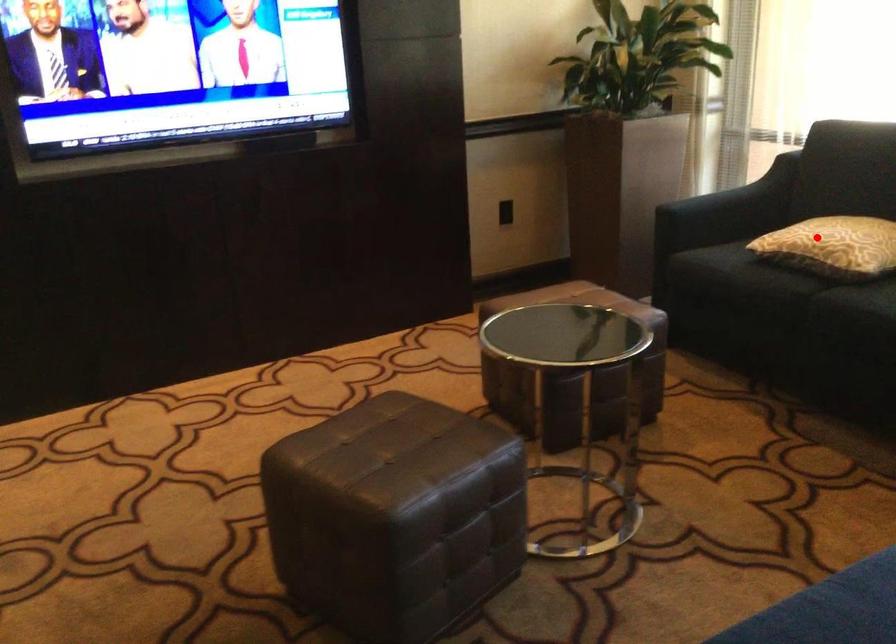
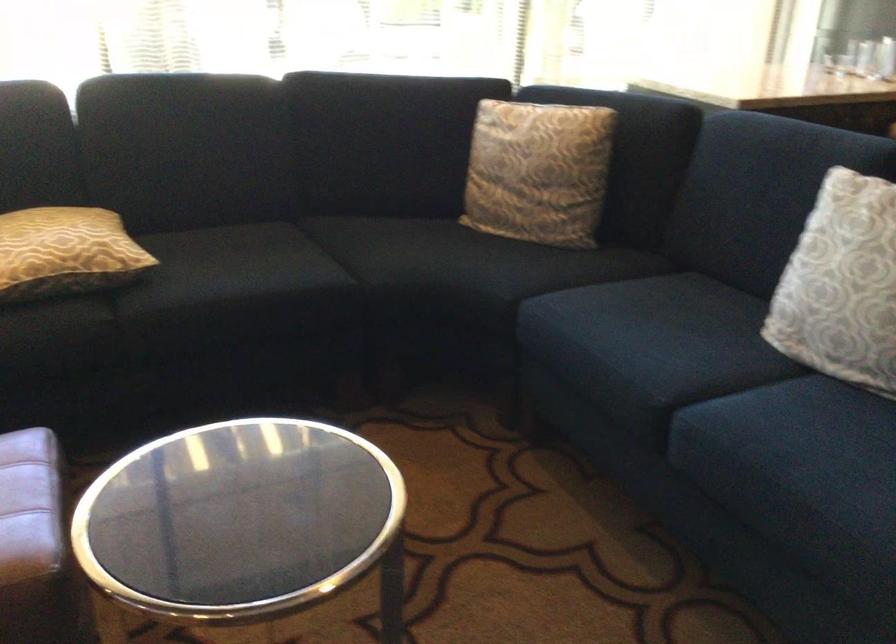
Where in the second image is the point corresponding to the highlighted location from the first image?

(65, 252)